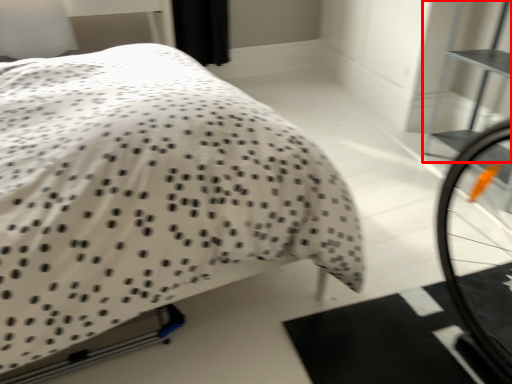
Question: From the image's perspective, what is the correct spatial relationship of bookshelf (annotated by the red box) in relation to bed?

Choices:
 (A) below
 (B) above

Answer: (B)